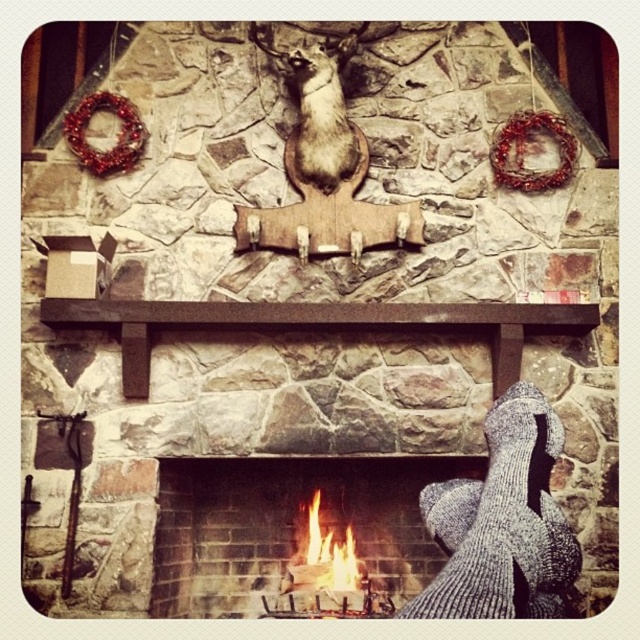
Question: Observing the image, what is the correct spatial positioning of brick fireplace at center in reference to fuzzy brown ferret at center?

Choices:
 (A) left
 (B) right

Answer: (A)

Question: Can you confirm if fuzzy brown ferret at center is positioned to the right of flamewooden logs at lower center?

Choices:
 (A) yes
 (B) no

Answer: (A)

Question: Which point appears farthest from the camera in this image?

Choices:
 (A) (173, 529)
 (B) (307, 80)
 (C) (356, 579)

Answer: (C)

Question: Is the position of fuzzy brown ferret at center less distant than that of flamewooden logs at lower center?

Choices:
 (A) no
 (B) yes

Answer: (A)

Question: Which point appears farthest from the camera in this image?

Choices:
 (A) tap(336, 93)
 (B) tap(296, 570)
 (C) tap(374, 480)

Answer: (C)

Question: Estimate the real-world distances between objects in this image. Which object is closer to the flamewooden logs at lower center?

Choices:
 (A) brick fireplace at center
 (B) fuzzy brown ferret at center

Answer: (A)